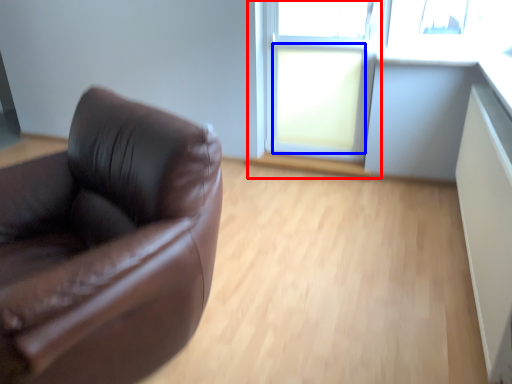
Question: Which object is closer to the camera taking this photo, window frame (highlighted by a red box) or window (highlighted by a blue box)?

Choices:
 (A) window frame
 (B) window

Answer: (A)